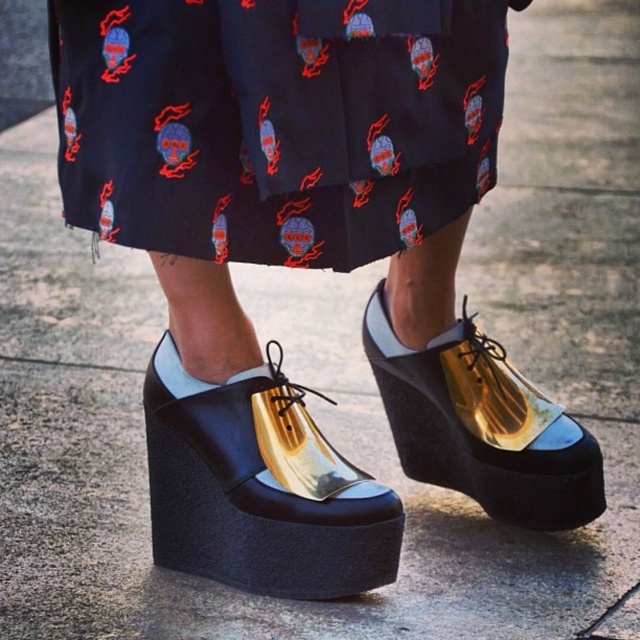
Question: Does gold shiny platform shoe at center appear on the left side of gold reflective platform shoe at center?

Choices:
 (A) no
 (B) yes

Answer: (B)

Question: Which of the following is the closest to the observer?

Choices:
 (A) (196, 440)
 (B) (276, 10)

Answer: (B)

Question: Does black cotton skirt at center have a greater width compared to gold shiny platform shoe at center?

Choices:
 (A) yes
 (B) no

Answer: (A)

Question: Which of the following is the closest to the observer?

Choices:
 (A) (307, 433)
 (B) (115, 188)
 (C) (528, 428)

Answer: (B)

Question: Which point is farther to the camera?

Choices:
 (A) black cotton skirt at center
 (B) gold shiny platform shoe at center
 (C) gold reflective platform shoe at center

Answer: (C)

Question: Is gold shiny platform shoe at center positioned at the back of gold reflective platform shoe at center?

Choices:
 (A) no
 (B) yes

Answer: (A)